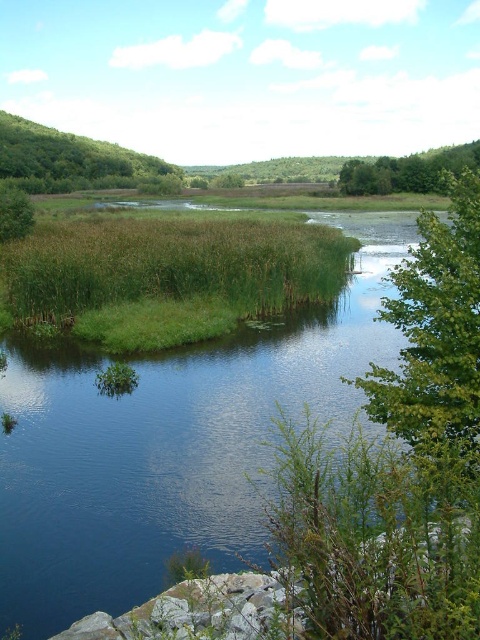
Question: In this image, where is green grassy river at center located relative to green leafy tree at upper right?

Choices:
 (A) above
 (B) below

Answer: (B)

Question: Where is green leafy tree at right located in relation to green leafy tree at upper left in the image?

Choices:
 (A) left
 (B) right

Answer: (B)

Question: Which point appears closest to the camera in this image?

Choices:
 (A) (24, 196)
 (B) (409, 154)
 (C) (49, 186)
 (D) (420, 412)

Answer: (D)

Question: Does green leafy tree at right have a smaller size compared to green leafy tree at left?

Choices:
 (A) no
 (B) yes

Answer: (B)

Question: Which object appears closest to the camera in this image?

Choices:
 (A) green grassy river at center
 (B) green leafy tree at right

Answer: (B)

Question: Estimate the real-world distances between objects in this image. Which object is farther from the green grassy river at center?

Choices:
 (A) green leafy tree at upper right
 (B) green leafy tree at upper left
 (C) green leafy tree at right
 (D) green leafy tree at left

Answer: (B)